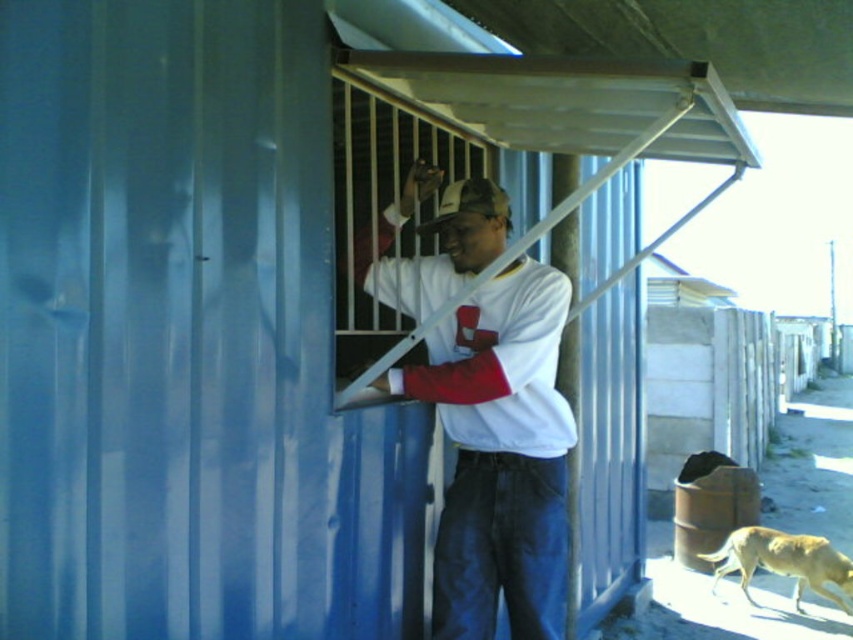
Measure the distance from white matte shirt at center to golden fur dog at lower right.

white matte shirt at center and golden fur dog at lower right are 3.94 meters apart.

Who is lower down, white matte shirt at center or golden fur dog at lower right?

golden fur dog at lower right is below.

Identify the location of white matte shirt at center. This screenshot has height=640, width=853. (498, 456).

Does white matte window at center appear under golden fur dog at lower right?

No, white matte window at center is not below golden fur dog at lower right.

Can you confirm if white matte window at center is thinner than golden fur dog at lower right?

Yes, white matte window at center is thinner than golden fur dog at lower right.

Describe the element at coordinates (381, 204) in the screenshot. I see `white matte window at center` at that location.

Where is `white matte window at center`? The image size is (853, 640). white matte window at center is located at coordinates (381, 204).

Does point (479, 390) come farther from viewer compared to point (334, 186)?

Yes, point (479, 390) is farther from viewer.

Which is more to the left, white matte shirt at center or white matte window at center?

white matte window at center is more to the left.

Based on the photo, who is more distant from viewer, (451, 332) or (369, 144)?

The point (369, 144) is behind.

The image size is (853, 640). Find the location of `white matte shirt at center`. white matte shirt at center is located at coordinates (498, 456).